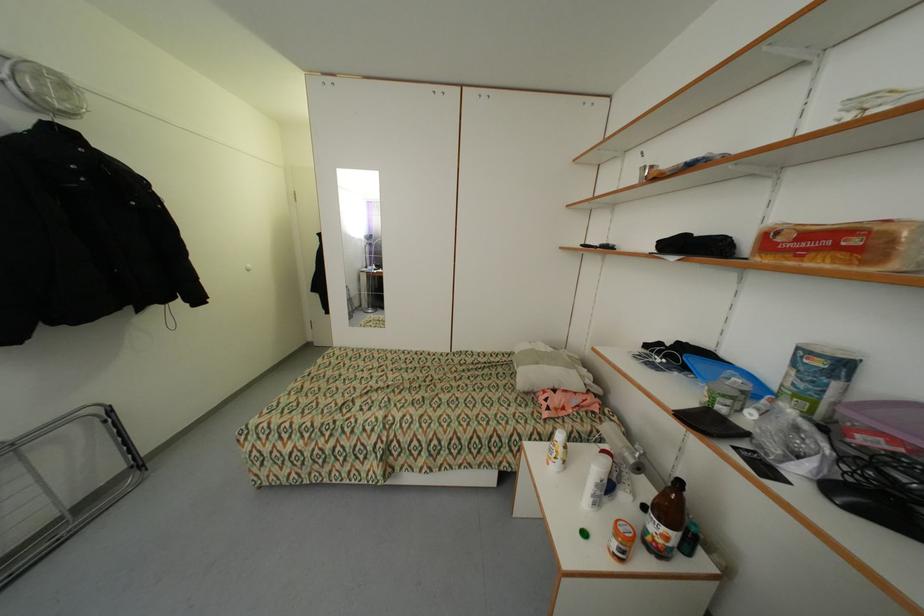
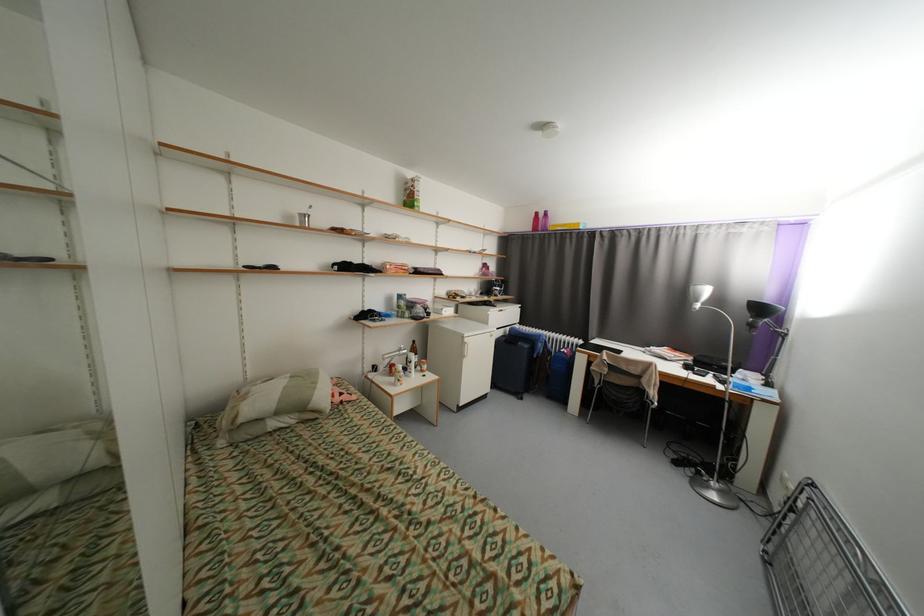
Where in the second image is the point corresponding to (542,363) from the first image?

(322, 384)